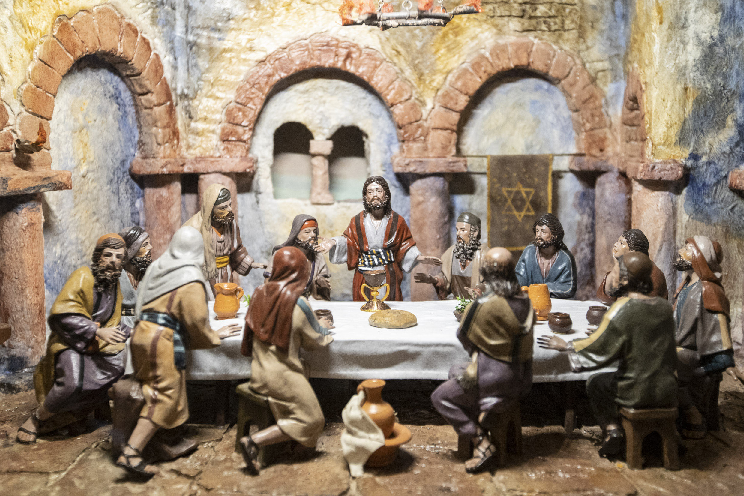
Identify the location of pottery. (561, 322), (597, 314), (541, 302), (368, 282), (228, 295), (376, 402).